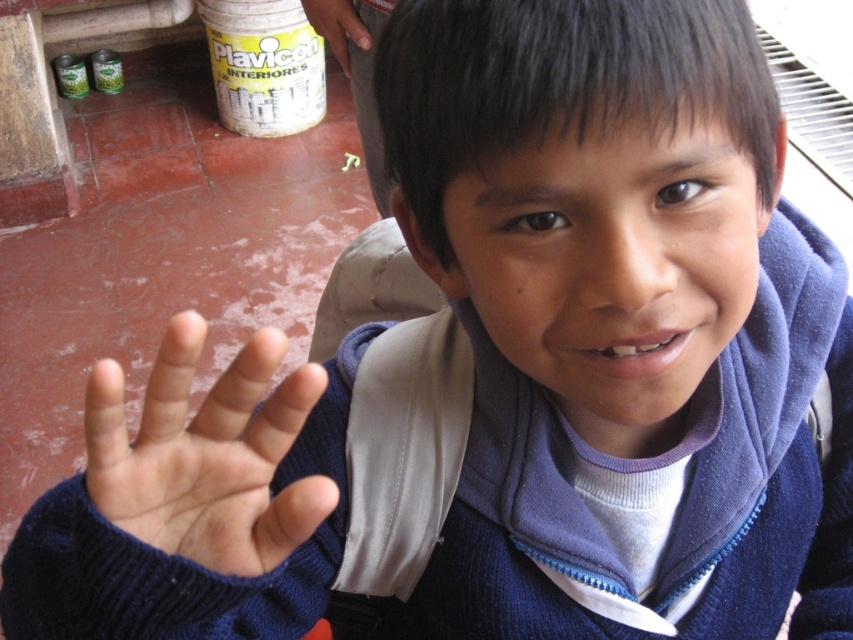
Question: Which point is closer to the camera?

Choices:
 (A) matte plastic can at upper left
 (B) light skin/soft skin palm at center

Answer: (B)

Question: Which point is farther to the camera?

Choices:
 (A) light skin/soft skin palm at center
 (B) matte plastic can at upper left

Answer: (B)

Question: Is the position of light skin/soft skin palm at center more distant than that of matte plastic can at upper left?

Choices:
 (A) yes
 (B) no

Answer: (B)

Question: Which of the following is the closest to the observer?

Choices:
 (A) (154, 372)
 (B) (323, 1)

Answer: (A)

Question: Does light skin/soft skin palm at center have a larger size compared to matte plastic can at upper left?

Choices:
 (A) yes
 (B) no

Answer: (B)

Question: Does light skin/soft skin palm at center have a larger size compared to matte plastic can at upper left?

Choices:
 (A) yes
 (B) no

Answer: (B)